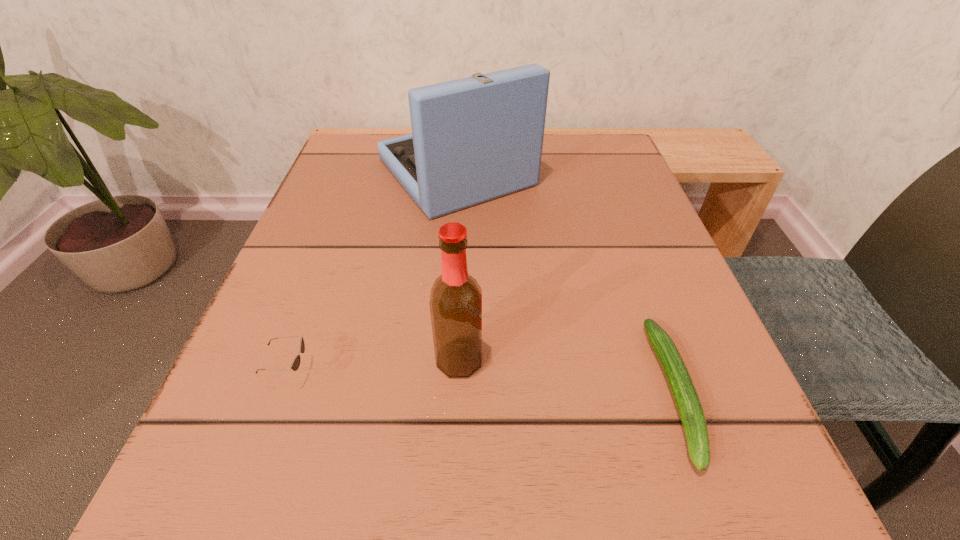
Where is `phonograph record at the left edge`? The height and width of the screenshot is (540, 960). phonograph record at the left edge is located at coordinates (475, 139).

Locate an element on the screen. This screenshot has height=540, width=960. sunglasses that is at the left edge is located at coordinates pyautogui.click(x=295, y=365).

Locate an element on the screen. object located in the right edge section of the desktop is located at coordinates (688, 404).

At what (x,y) coordinates should I click in order to perform the action: click on object that is at the far left corner. Please return your answer as a coordinate pair (x, y). The height and width of the screenshot is (540, 960). Looking at the image, I should click on (475, 139).

Find the location of a particular element. The height and width of the screenshot is (540, 960). object located at the near right corner is located at coordinates (688, 404).

Identify the location of free space at the near edge. (467, 519).

The image size is (960, 540). Find the location of `vacant space at the left edge of the desktop`. vacant space at the left edge of the desktop is located at coordinates (321, 229).

The image size is (960, 540). Identify the location of vacant space at the right edge of the desktop. (624, 199).

The height and width of the screenshot is (540, 960). Identify the location of free region at the near left corner of the desktop. (217, 470).

The image size is (960, 540). Find the location of `free region at the far right corner of the desktop`. free region at the far right corner of the desktop is located at coordinates (591, 166).